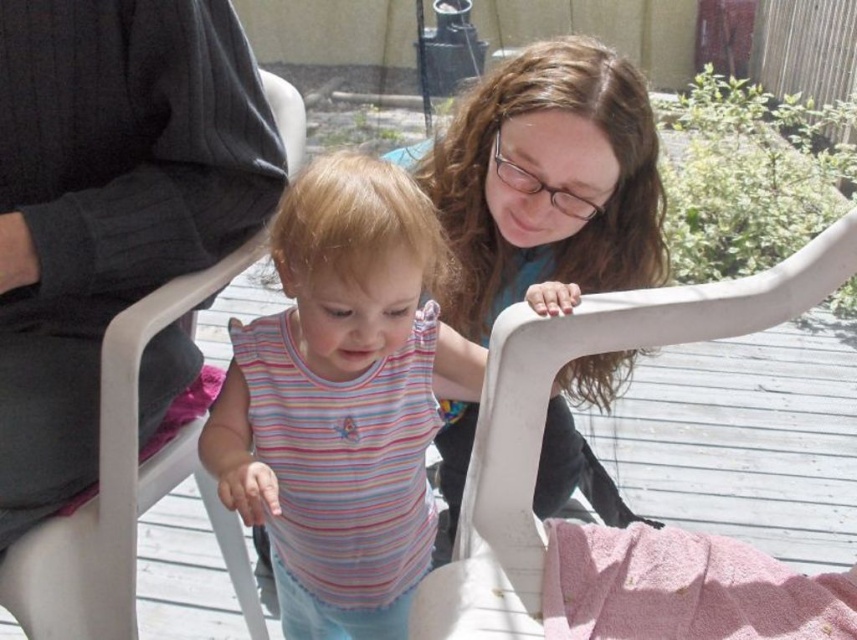
You are a guest at a garden party and need to place a 1.2 meter long decorative banner between the striped fabric at center and the white plastic chair at left. Can the banner fit between them based on their widths?

The striped fabric at center is wider than the white plastic chair at left, but the banner requires 1.2 meters of space. Since the exact widths aren not provided, we cannot confirm if the combined width allows the banner to fit. However, the description only states the fabric is wider, not the actual dimensions. Therefore, it is uncertain if the banner will fit without more information.

You are a guest at a garden party and see the striped fabric at center and the white plastic chair at left. Which object is covering the other?

The striped fabric at center is positioned over the white plastic chair at left, so the striped fabric is covering the white plastic chair.

You are a guest at a backyard gathering and see the striped fabric at center and the white plastic folding chair at upper center. Which item is located to the left of the other?

The striped fabric at center is positioned on the left side of white plastic folding chair at upper center.